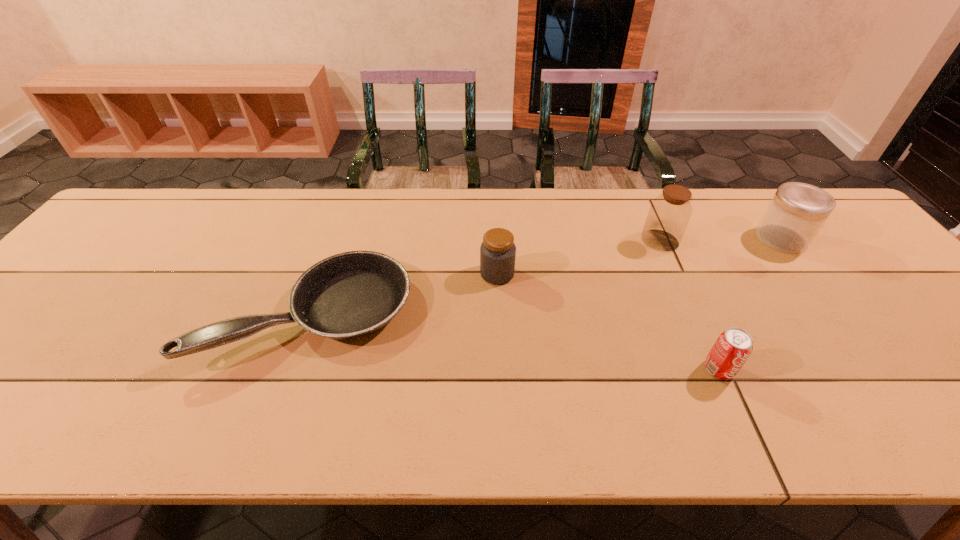
At what (x,y) coordinates should I click in order to perform the action: click on the second jar from right to left. Please return your answer as a coordinate pair (x, y). This screenshot has width=960, height=540. Looking at the image, I should click on 669,213.

The image size is (960, 540). I want to click on the rightmost object, so click(x=797, y=212).

Find the location of a particular element. the leftmost jar is located at coordinates (498, 251).

Where is `the nearest jar`? The width and height of the screenshot is (960, 540). the nearest jar is located at coordinates (498, 251).

Locate an element on the screen. The width and height of the screenshot is (960, 540). the second shortest object is located at coordinates (733, 347).

Locate an element on the screen. The height and width of the screenshot is (540, 960). the shortest object is located at coordinates (349, 295).

You are a GUI agent. You are given a task and a screenshot of the screen. Output one action in this format:
    pyautogui.click(x=<x>, y=<y>)
    Task: Click on the frying pan
    Image resolution: width=960 pixels, height=540 pixels.
    Given the screenshot: What is the action you would take?
    pyautogui.click(x=349, y=295)

The height and width of the screenshot is (540, 960). I want to click on free point located on the front of the second jar from left to right, so click(x=677, y=279).

Locate an element on the screen. free spot located 0.330m on the front of the rightmost object is located at coordinates (868, 354).

You are a GUI agent. You are given a task and a screenshot of the screen. Output one action in this format:
    pyautogui.click(x=<x>, y=<y>)
    Task: Click on the free space located 0.140m on the surface of the nearest jar near the warning symbol
    The image size is (960, 540).
    Given the screenshot: What is the action you would take?
    pos(427,274)